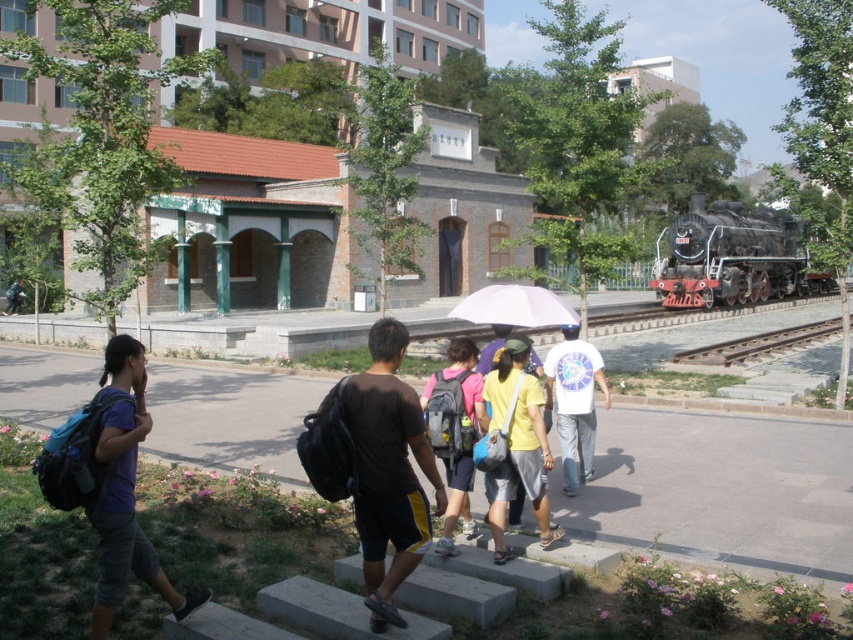
Question: Is blue backpack at left to the right of white matte umbrella at center from the viewer's perspective?

Choices:
 (A) yes
 (B) no

Answer: (B)

Question: Is black matte backpack at center closer to the viewer compared to yellow matte shirt at center?

Choices:
 (A) yes
 (B) no

Answer: (A)

Question: Is yellow matte shirt at center further to the viewer compared to metal train track at right?

Choices:
 (A) yes
 (B) no

Answer: (B)

Question: Which of these objects is positioned closest to the white matte umbrella at center?

Choices:
 (A) gray concrete stairs at lower center
 (B) polished black locomotive at right

Answer: (A)

Question: Which of the following is the closest to the observer?

Choices:
 (A) gray concrete stairs at lower center
 (B) yellow matte shirt at center
 (C) polished black locomotive at right
 (D) metal train track at right

Answer: (A)

Question: Which object is the closest to the white cotton t-shirt at center?

Choices:
 (A) yellow matte shirt at center
 (B) matte pink backpack at center
 (C) polished black locomotive at right
 (D) metal train track at right

Answer: (A)